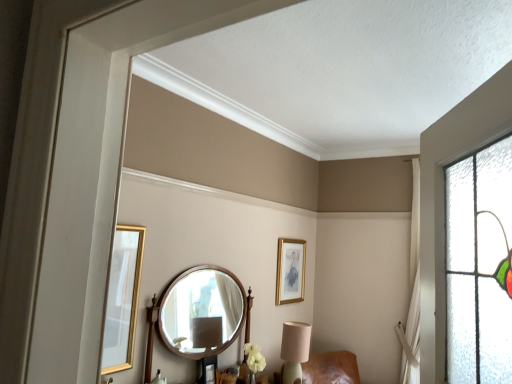
Question: Is matte beige table lamp at lower center placed right next to gold-framed picture at upper center?

Choices:
 (A) no
 (B) yes

Answer: (A)

Question: From the image's perspective, is matte beige table lamp at lower center under gold-framed picture at upper center?

Choices:
 (A) no
 (B) yes

Answer: (B)

Question: Is matte beige table lamp at lower center positioned in front of gold-framed picture at upper center?

Choices:
 (A) no
 (B) yes

Answer: (B)

Question: Does matte beige table lamp at lower center have a lesser width compared to gold-framed picture at upper center?

Choices:
 (A) no
 (B) yes

Answer: (A)

Question: Does matte beige table lamp at lower center appear on the left side of gold-framed picture at upper center?

Choices:
 (A) yes
 (B) no

Answer: (A)

Question: Considering the relative sizes of matte beige table lamp at lower center and gold-framed picture at upper center in the image provided, is matte beige table lamp at lower center bigger than gold-framed picture at upper center?

Choices:
 (A) no
 (B) yes

Answer: (B)

Question: Can you confirm if gold-framed picture at upper center is positioned to the right of wooden round mirror at center?

Choices:
 (A) yes
 (B) no

Answer: (A)

Question: From the image's perspective, does gold-framed picture at upper center appear higher than wooden round mirror at center?

Choices:
 (A) yes
 (B) no

Answer: (A)

Question: Considering the relative sizes of gold-framed picture at upper center and wooden round mirror at center in the image provided, is gold-framed picture at upper center wider than wooden round mirror at center?

Choices:
 (A) no
 (B) yes

Answer: (A)

Question: Does gold-framed picture at upper center have a smaller size compared to wooden round mirror at center?

Choices:
 (A) no
 (B) yes

Answer: (B)

Question: From a real-world perspective, is gold-framed picture at upper center beneath wooden round mirror at center?

Choices:
 (A) no
 (B) yes

Answer: (A)

Question: Can you confirm if gold-framed picture at upper center is thinner than wooden round mirror at center?

Choices:
 (A) yes
 (B) no

Answer: (A)

Question: Is gold-framed picture at upper center at the right side of matte beige table lamp at lower center?

Choices:
 (A) yes
 (B) no

Answer: (A)